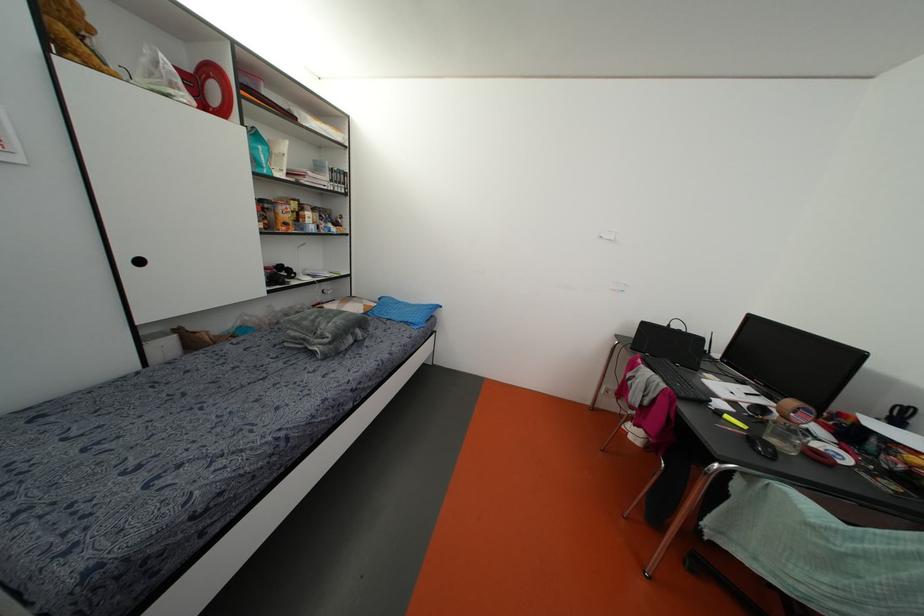
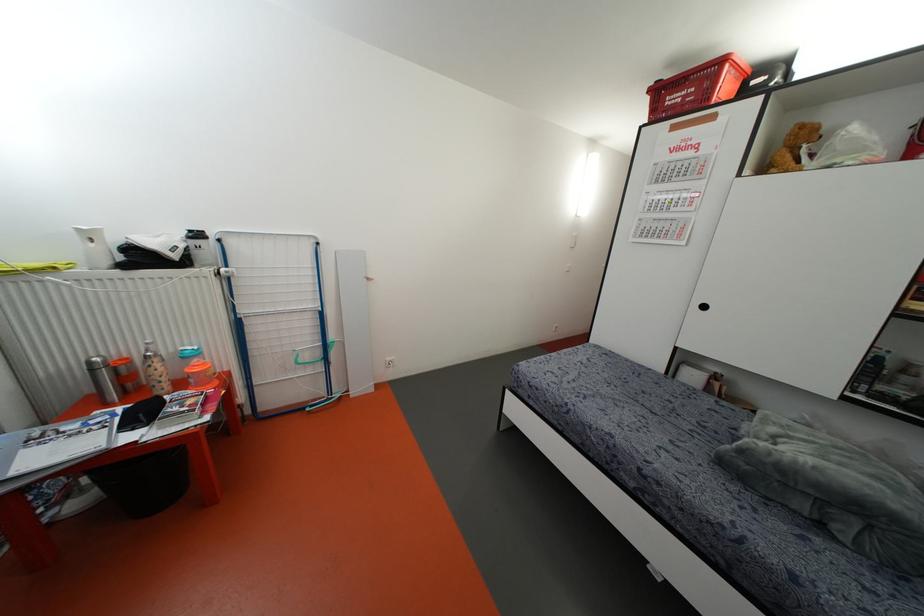
In the second image, find the point that corresponds to (140,262) in the first image.

(703, 307)